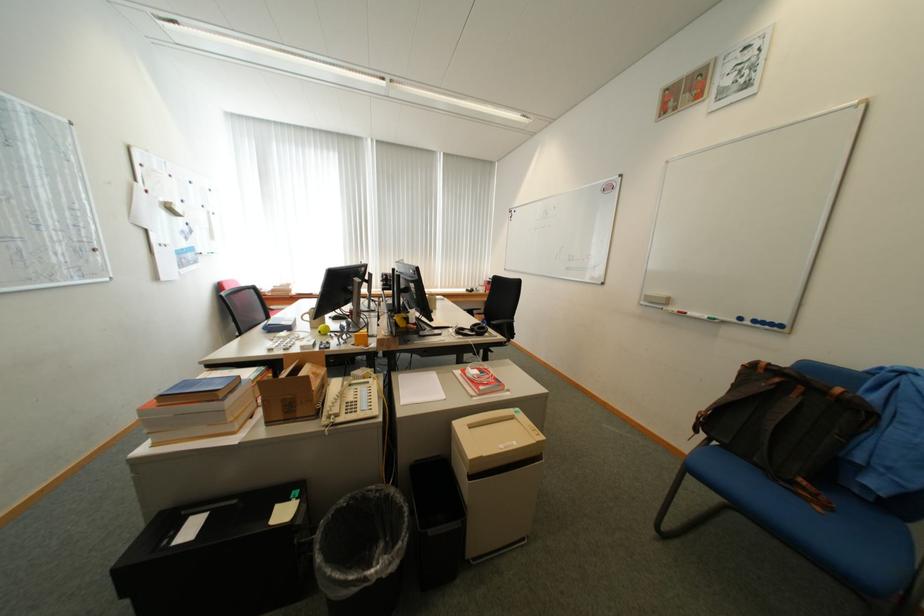
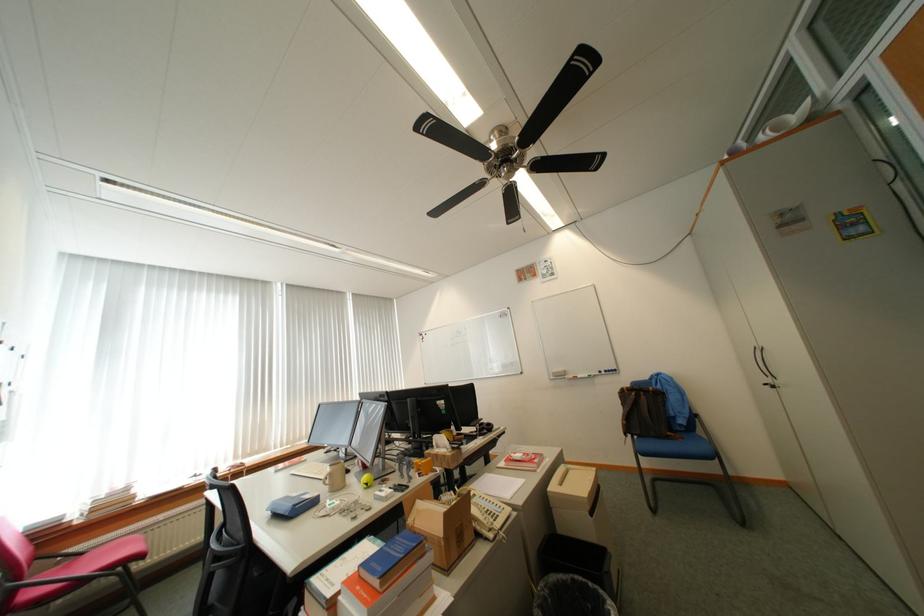
Locate, in the second image, the point that corresponds to [317,320] in the first image.

(336, 482)